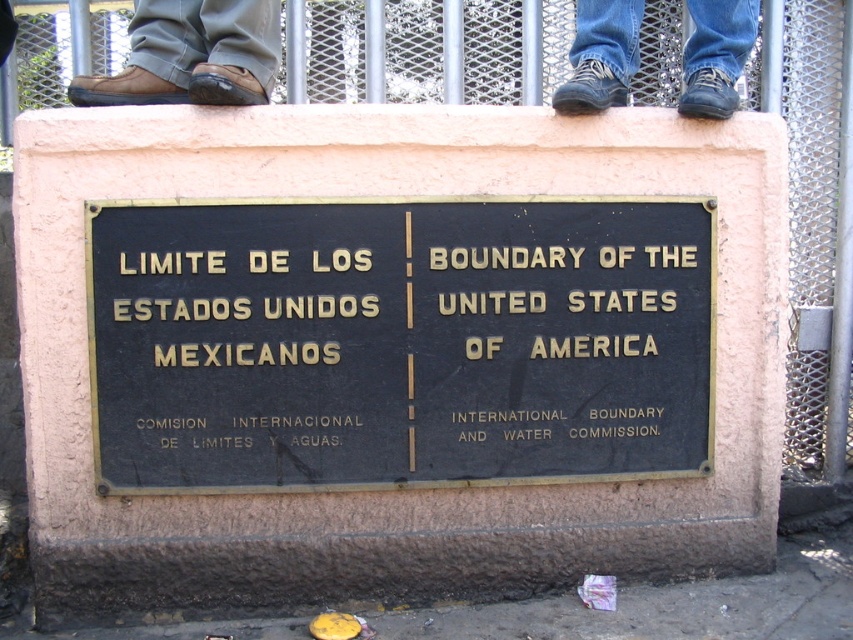
Is the position of brown suede shoe at lower left less distant than that of blue suede shoe at upper right?

That is True.

Between point (77, 76) and point (711, 88), which one is positioned behind?

Positioned behind is point (77, 76).

Who is more forward, (x=144, y=99) or (x=724, y=84)?

Point (x=144, y=99)

In order to click on brown suede shoe at lower left in this screenshot , I will do `click(125, 90)`.

Who is taller, brown leather shoes at upper left or brown suede shoe at lower left?

With more height is brown leather shoes at upper left.

Is brown leather shoes at upper left to the right of brown suede shoe at lower left from the viewer's perspective?

Indeed, brown leather shoes at upper left is positioned on the right side of brown suede shoe at lower left.

Between point (258, 88) and point (175, 102), which one is positioned behind?

Point (175, 102)

Locate an element on the screen. brown leather shoes at upper left is located at coordinates (192, 54).

Is point (547, 337) positioned after point (740, 13)?

No, (547, 337) is in front of (740, 13).

Is point (692, 212) positioned in front of point (717, 54)?

Yes, point (692, 212) is closer to viewer.

Does point (117, 435) lie behind point (729, 116)?

No, it is in front of (729, 116).

The height and width of the screenshot is (640, 853). In order to click on black polished metal sign at center in this screenshot , I will do `click(398, 342)`.